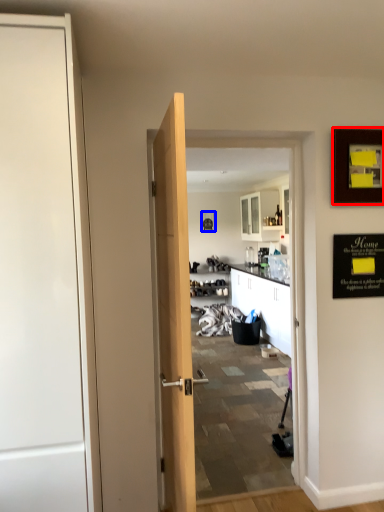
Question: Which point is further to the camera, picture frame (highlighted by a red box) or picture frame (highlighted by a blue box)?

Choices:
 (A) picture frame
 (B) picture frame

Answer: (B)